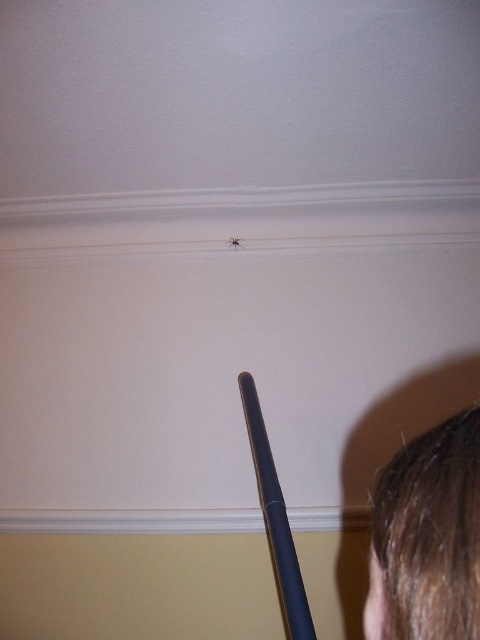
Question: Does dark brown hair at lower right appear on the left side of translucent plastic spider at upper center?

Choices:
 (A) no
 (B) yes

Answer: (A)

Question: Which point is farther to the camera?

Choices:
 (A) (240, 243)
 (B) (417, 572)

Answer: (A)

Question: Does dark brown hair at lower right have a greater width compared to translucent plastic spider at upper center?

Choices:
 (A) yes
 (B) no

Answer: (A)

Question: Does dark brown hair at lower right lie behind translucent plastic spider at upper center?

Choices:
 (A) yes
 (B) no

Answer: (B)

Question: Which object is farther from the camera taking this photo?

Choices:
 (A) translucent plastic spider at upper center
 (B) dark brown hair at lower right

Answer: (A)